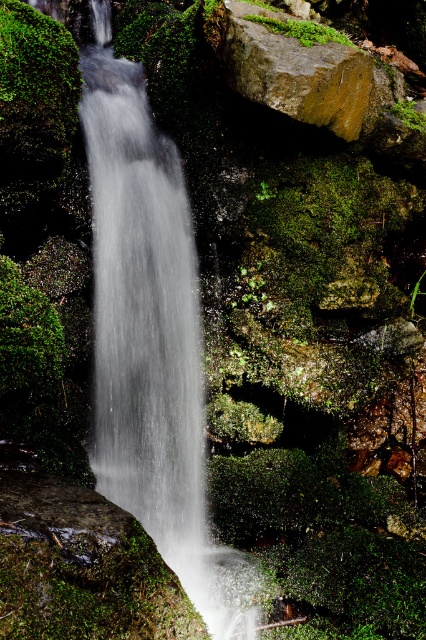
You are a photographer planning to capture the waterfall scene. You want to ensure that the white frothy water at center and the green mossy rock at upper center are both visible in your shot. Given their sizes, which object will require you to adjust your camera angle to fit into the frame first?

The white frothy water at center has a smaller width compared to the green mossy rock at upper center, so you will need to adjust your camera angle to ensure the wider green mossy rock at upper center fits into the frame first.

You are standing at the base of the waterfall in the serene natural scene. You notice two points marked in the image. Which point, point (256, 580) or point (252, 44), is closer to you?

Point (256, 580) is closer to the camera than point (252, 44), so the point closer to you is point (256, 580).